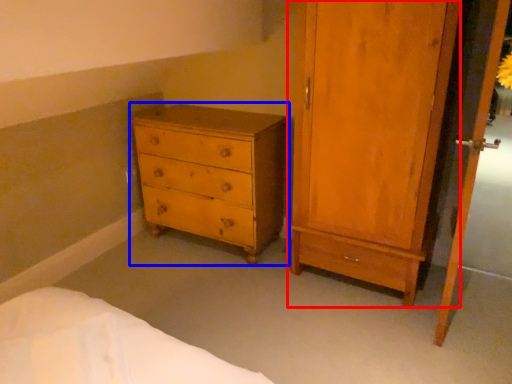
Question: Which point is closer to the camera, door (highlighted by a red box) or chest of drawers (highlighted by a blue box)?

Choices:
 (A) door
 (B) chest of drawers

Answer: (A)